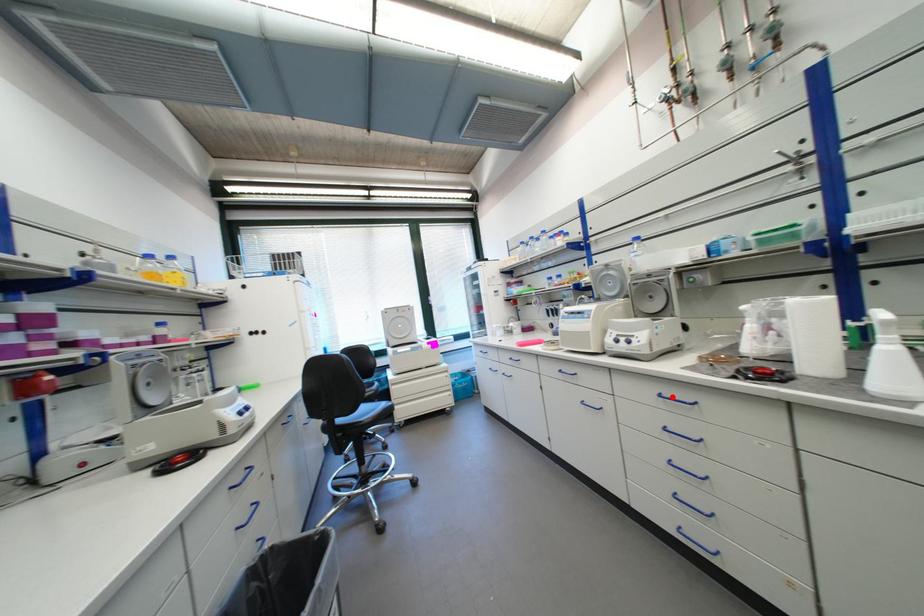
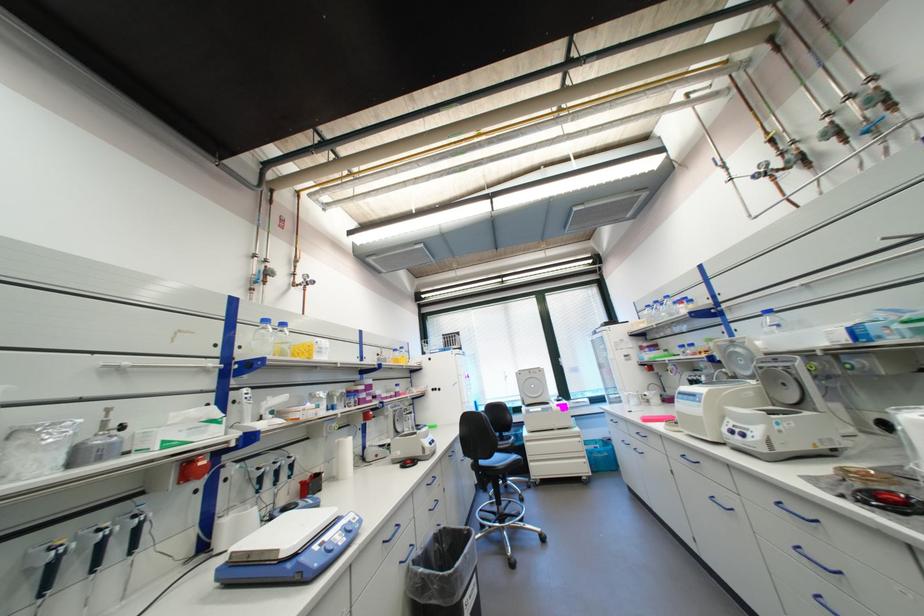
Find the pixel in the second image that matches the highlighted location in the first image.

(795, 507)